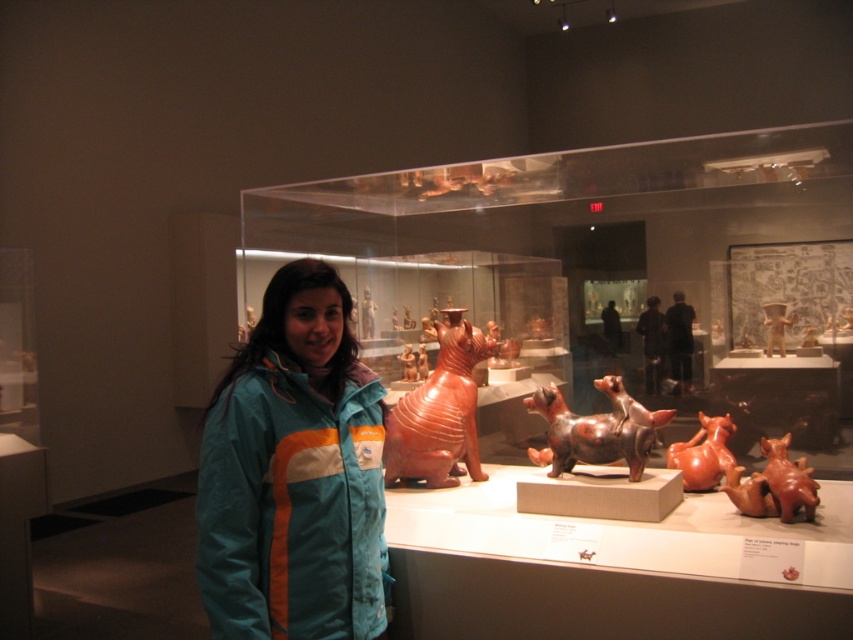
Question: Can you confirm if teal fabric jacket at center is thinner than shiny brown dog at center?

Choices:
 (A) yes
 (B) no

Answer: (A)

Question: Among these objects, which one is farthest from the camera?

Choices:
 (A) shiny brown dog at center
 (B) teal fabric jacket at center
 (C) matte terracotta cat at center

Answer: (C)

Question: Which point appears closest to the camera in this image?

Choices:
 (A) (676, 460)
 (B) (592, 440)

Answer: (B)

Question: Can you confirm if teal fabric jacket at center is positioned below matte terracotta cat at center?

Choices:
 (A) no
 (B) yes

Answer: (B)

Question: Is matte terracotta cat at center to the left of matte orange clay dog at center from the viewer's perspective?

Choices:
 (A) yes
 (B) no

Answer: (A)

Question: Based on their relative distances, which object is nearer to the teal fabric jacket at center?

Choices:
 (A) matte orange clay dog at center
 (B) shiny brown dog at center
 (C) matte terracotta cat at center

Answer: (C)